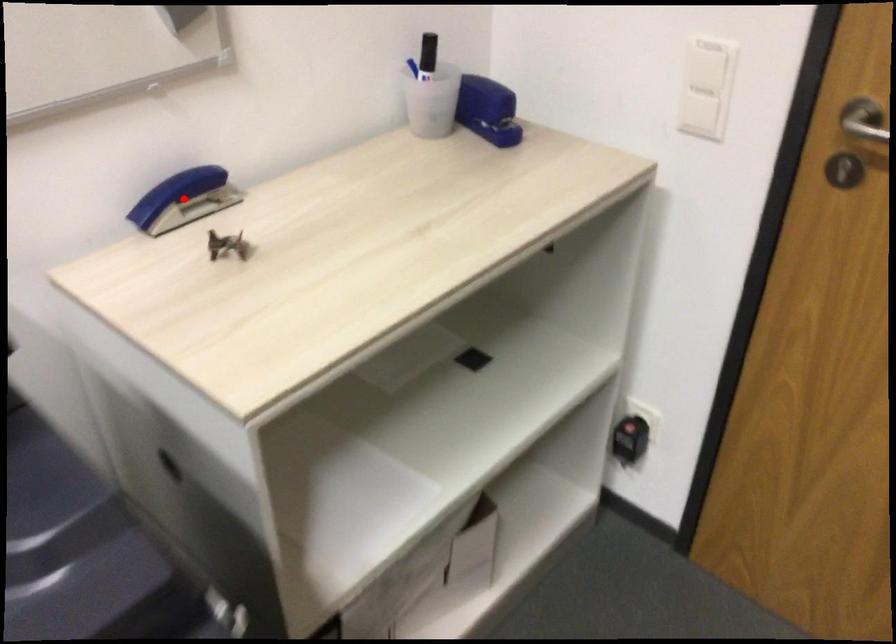
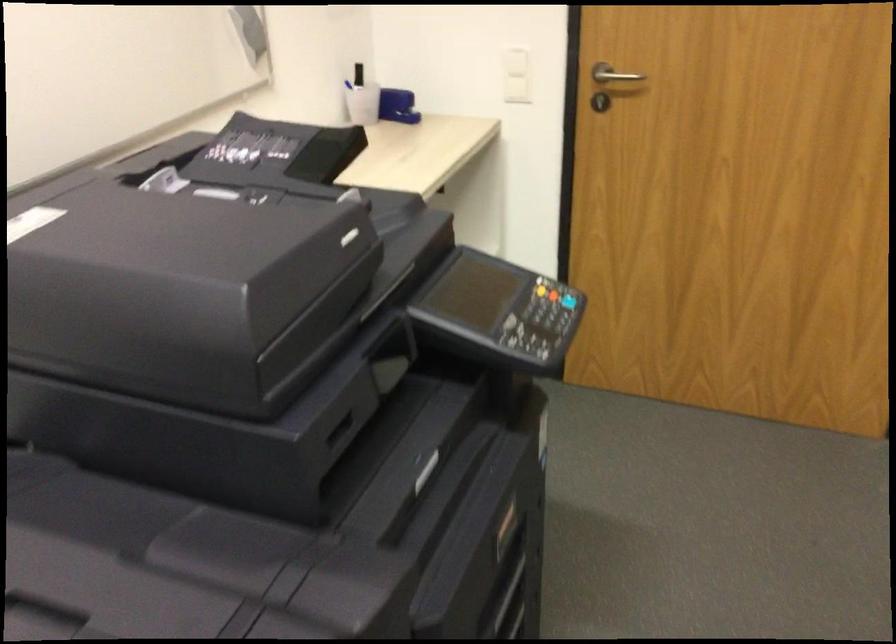
Question: I am providing you with two images of the same scene from different viewpoints. A red point is marked on the first image. Is the red point's position out of view in image 2?

Choices:
 (A) Yes
 (B) No

Answer: (A)